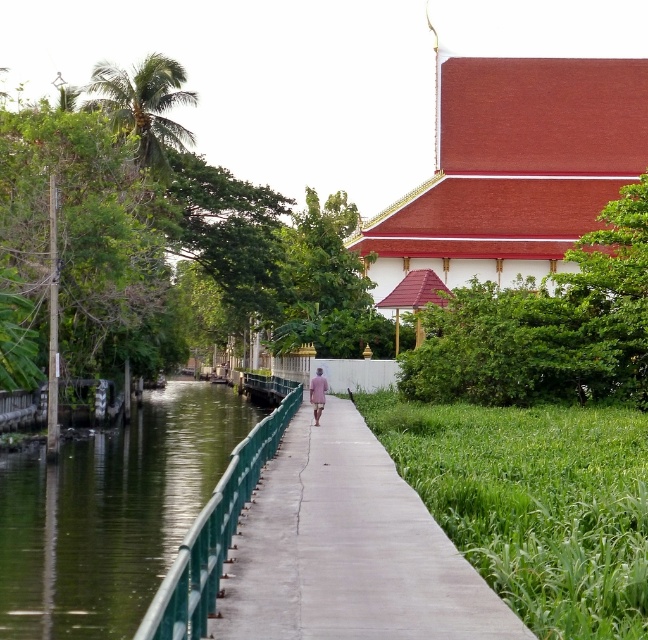
You are standing on the pathway and want to reach the grassy area on the right. Which direction should you walk to avoid the green metallic railing at lower left?

To reach the grassy area on the right while avoiding the green metallic railing at lower left, you should walk towards the right side of the image, away from the railing located at the lower left position.